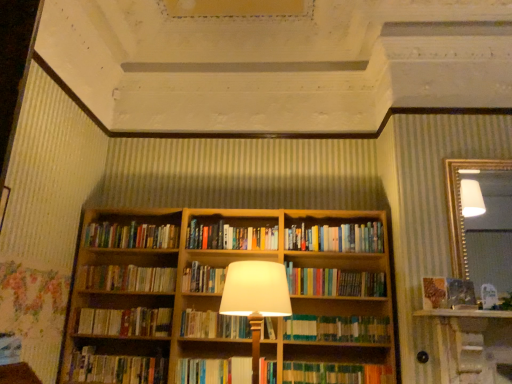
Question: Which direction should I rotate to look at green textured book at center, the 4th book in the bottom-to-top sequence?

Choices:
 (A) left
 (B) right

Answer: (B)

Question: Can you confirm if green textured book at center, which is the 8th book in top-to-bottom order, is shorter than wooden bookcase at center?

Choices:
 (A) yes
 (B) no

Answer: (A)

Question: Considering the relative sizes of green textured book at center, the 4th book in the bottom-to-top sequence, and wooden bookcase at center in the image provided, is green textured book at center, the 4th book in the bottom-to-top sequence, smaller than wooden bookcase at center?

Choices:
 (A) yes
 (B) no

Answer: (A)

Question: Is green textured book at center, which is the 8th book in top-to-bottom order, far away from wooden bookcase at center?

Choices:
 (A) no
 (B) yes

Answer: (A)

Question: Is wooden bookcase at center completely or partially inside green textured book at center, which is the 8th book in top-to-bottom order?

Choices:
 (A) no
 (B) yes

Answer: (A)

Question: Is green textured book at center, the 4th book in the bottom-to-top sequence, beside wooden bookcase at center?

Choices:
 (A) yes
 (B) no

Answer: (B)

Question: Can you confirm if green textured book at center, which is the 8th book in top-to-bottom order, is bigger than wooden bookcase at center?

Choices:
 (A) yes
 (B) no

Answer: (B)

Question: Is multicolored books at center, acting as the fifth book starting from the top, at the right side of matte white lampshade at center?

Choices:
 (A) yes
 (B) no

Answer: (A)

Question: Does multicolored books at center, which is counted as the seventh book, starting from the bottom, have a smaller size compared to matte white lampshade at center?

Choices:
 (A) yes
 (B) no

Answer: (A)

Question: Is multicolored books at center, acting as the fifth book starting from the top, completely or partially outside of matte white lampshade at center?

Choices:
 (A) no
 (B) yes

Answer: (B)

Question: Is matte white lampshade at center at the back of multicolored books at center, acting as the fifth book starting from the top?

Choices:
 (A) no
 (B) yes

Answer: (A)

Question: Considering the relative sizes of multicolored books at center, acting as the fifth book starting from the top, and matte white lampshade at center in the image provided, is multicolored books at center, acting as the fifth book starting from the top, shorter than matte white lampshade at center?

Choices:
 (A) yes
 (B) no

Answer: (A)

Question: From a real-world perspective, is multicolored books at center, which is counted as the seventh book, starting from the bottom, physically below matte white lampshade at center?

Choices:
 (A) yes
 (B) no

Answer: (B)

Question: From the image's perspective, does hardcover book at center, acting as the second book starting from the bottom, appear lower than wooden bookcase at center?

Choices:
 (A) no
 (B) yes

Answer: (B)